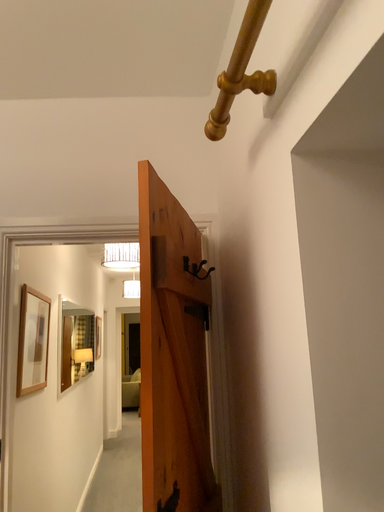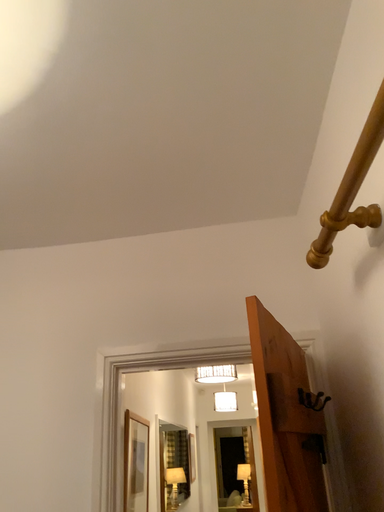
Question: Which way did the camera rotate in the video?

Choices:
 (A) rotated upward
 (B) rotated downward

Answer: (A)